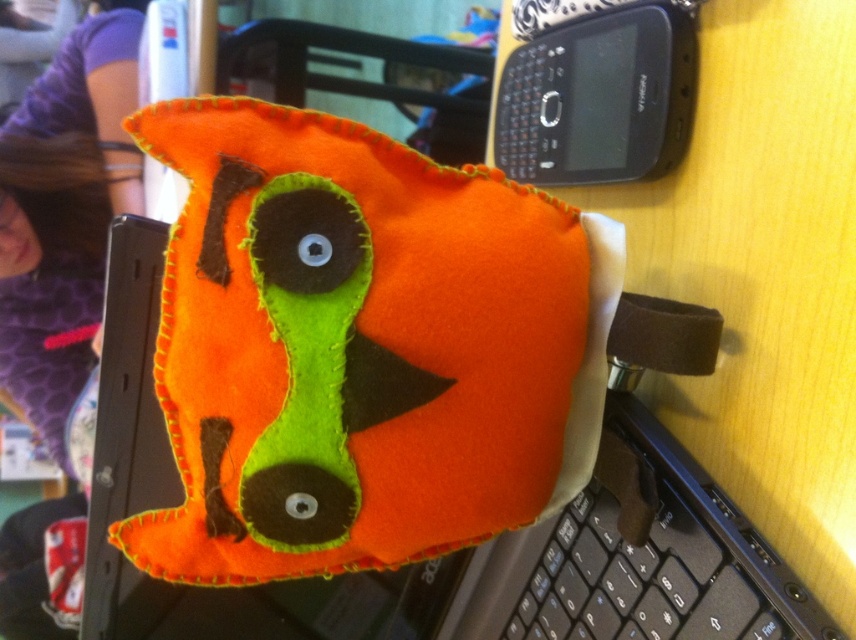
Question: Is orange felt plush toy at center below black plastic keyboard at lower right?

Choices:
 (A) yes
 (B) no

Answer: (B)

Question: Is the position of orange felt plush toy at center more distant than that of purple fabric hair at upper left?

Choices:
 (A) no
 (B) yes

Answer: (A)

Question: Which object is positioned farthest from the orange felt plush toy at center?

Choices:
 (A) purple fabric hair at upper left
 (B) black plastic keyboard at lower right

Answer: (A)

Question: Which is farther from the black plastic keyboard at lower right?

Choices:
 (A) purple fabric hair at upper left
 (B) black plastic smartphone at upper right

Answer: (A)

Question: Does orange felt plush toy at center have a smaller size compared to black plastic keyboard at lower right?

Choices:
 (A) no
 (B) yes

Answer: (A)

Question: Which object is positioned farthest from the purple fabric hair at upper left?

Choices:
 (A) orange felt plush toy at center
 (B) black plastic smartphone at upper right

Answer: (B)